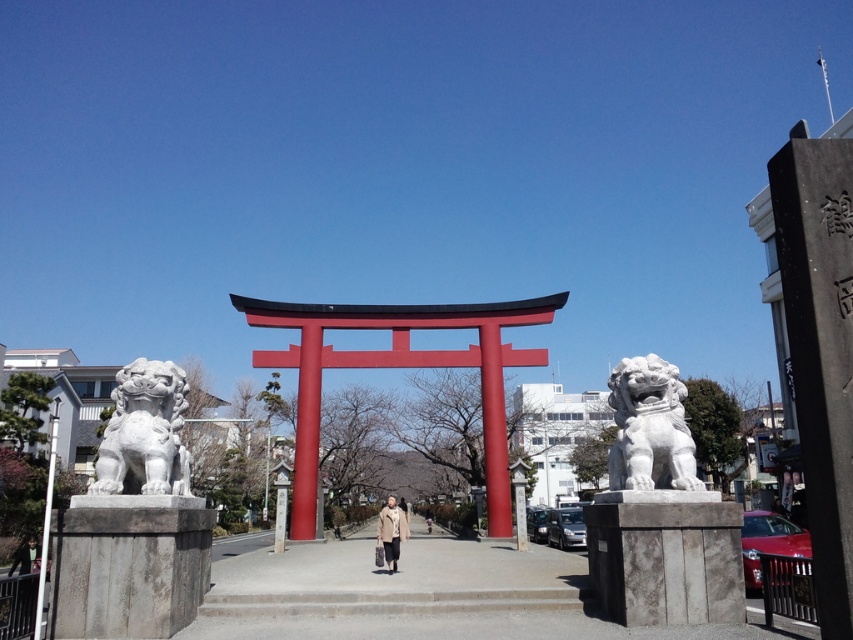
You are a visitor at the Shinto shrine and want to take a photo of the white stone lion at left and the light brown textured coat at center together in the frame. Given that your camera has a maximum focus range of 5 meters, will you be able to capture both objects in one shot?

The distance between the white stone lion at left and the light brown textured coat at center is 5.03 meters. Since the camera can only focus up to 5 meters, it won not be able to capture both objects in one shot as the distance exceeds the focus range.

You are standing at the entrance of the Shinto shrine and see the white stone lion at center and the light brown textured coat at center. Which object is positioned higher in the scene?

The white stone lion at center is positioned higher than the light brown textured coat at center.